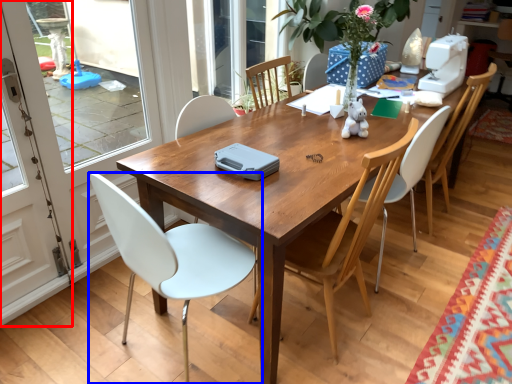
Question: Which point is further to the camera, screen door (highlighted by a red box) or chair (highlighted by a blue box)?

Choices:
 (A) screen door
 (B) chair

Answer: (A)